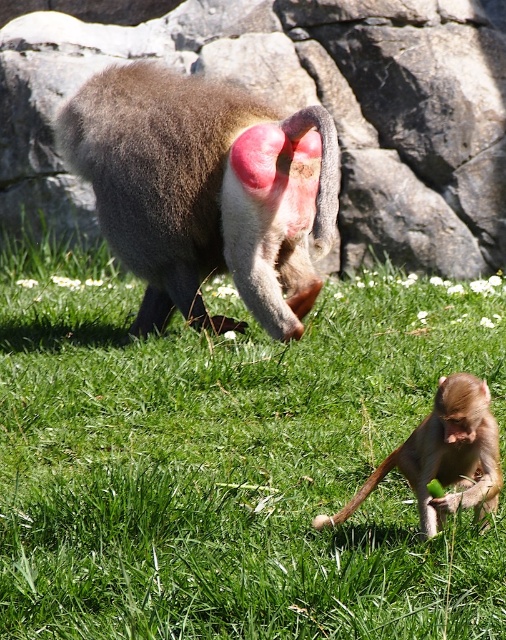
Question: Which is nearer to the light brown fur monkey at lower right?

Choices:
 (A) green grass at center
 (B) gray rock at upper center

Answer: (A)

Question: Does green grass at center lie behind gray rock at upper center?

Choices:
 (A) no
 (B) yes

Answer: (A)

Question: Which object is closer to the camera taking this photo?

Choices:
 (A) light brown fur monkey at lower right
 (B) brown furry monkey at center
 (C) green grass at center
 (D) gray rock at upper center

Answer: (C)

Question: Is green grass at center to the right of gray rock at upper center from the viewer's perspective?

Choices:
 (A) yes
 (B) no

Answer: (A)

Question: Can you confirm if green grass at center is positioned below light brown fur monkey at lower right?

Choices:
 (A) yes
 (B) no

Answer: (B)

Question: Which of these objects is positioned closest to the gray rock at upper center?

Choices:
 (A) green grass at center
 (B) light brown fur monkey at lower right
 (C) brown furry monkey at center

Answer: (C)